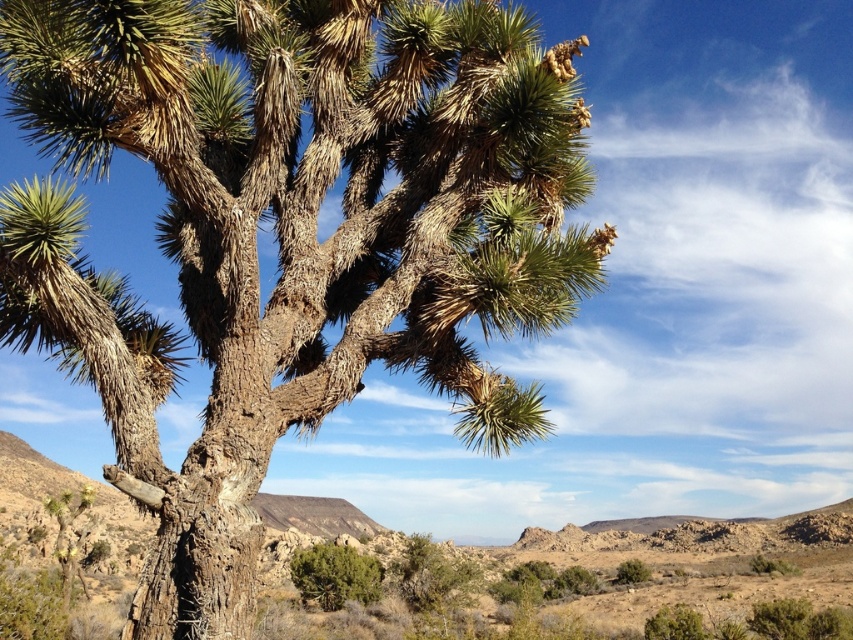
You are standing in the desert and see the brown rough bark tree at center and the green leafy bush at lower center. Which object is positioned more to the right side of the scene?

The brown rough bark tree at center is positioned more to the right side of the scene compared to the green leafy bush at lower center.